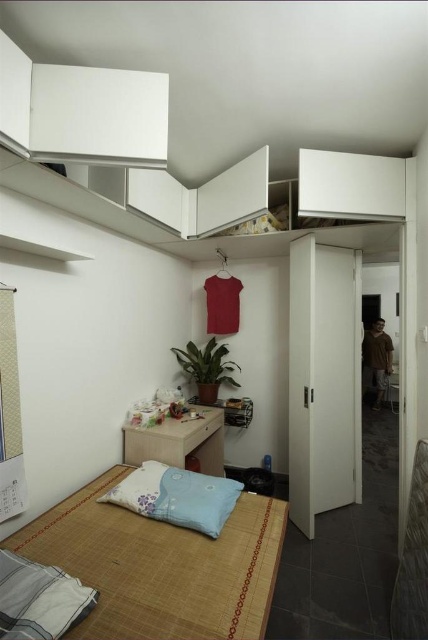
Question: Can you confirm if bamboo mat bed at lower left is positioned to the right of blue fabric pillow at lower center?

Choices:
 (A) yes
 (B) no

Answer: (A)

Question: Which object is positioned farthest from the blue fabric pillow at lower left?

Choices:
 (A) blue fabric pillow at lower center
 (B) bamboo mat bed at lower left

Answer: (A)

Question: Which object is positioned farthest from the blue fabric pillow at lower left?

Choices:
 (A) blue fabric pillow at lower center
 (B) bamboo mat bed at lower left

Answer: (A)

Question: Is bamboo mat bed at lower left above blue fabric pillow at lower center?

Choices:
 (A) yes
 (B) no

Answer: (B)

Question: Which object is closer to the camera taking this photo?

Choices:
 (A) bamboo mat bed at lower left
 (B) blue fabric pillow at lower left

Answer: (B)

Question: Is bamboo mat bed at lower left further to camera compared to blue fabric pillow at lower center?

Choices:
 (A) yes
 (B) no

Answer: (B)